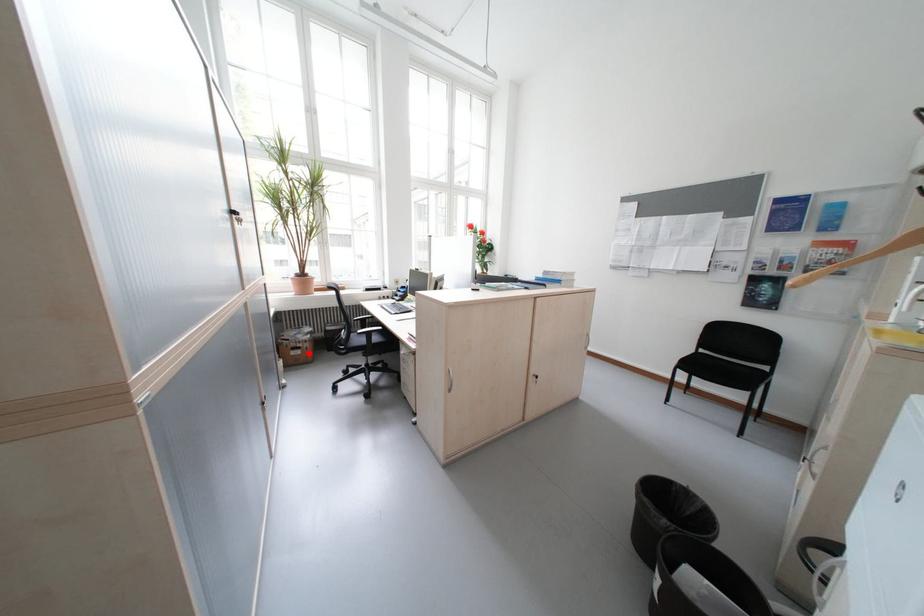
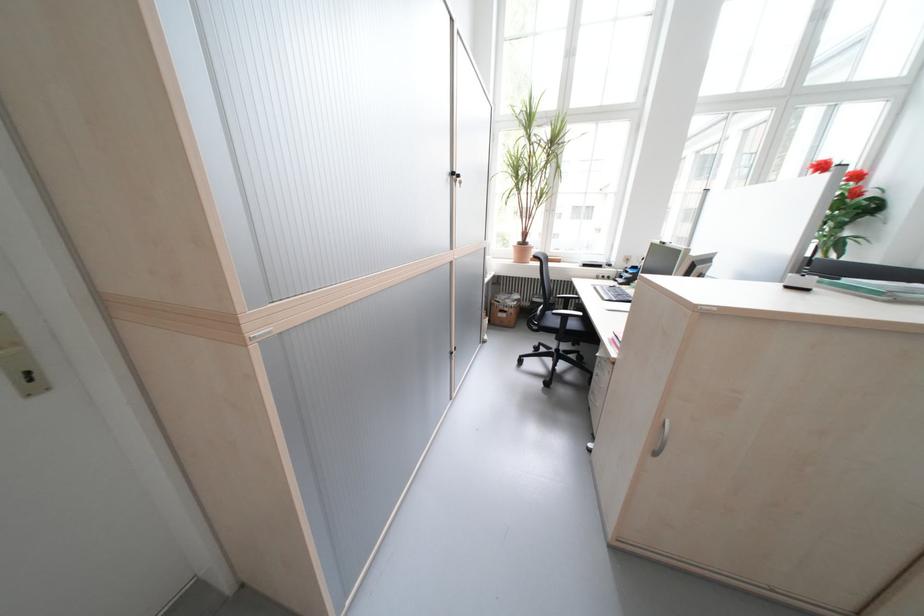
Find the pixel in the second image that matches the highlighted location in the first image.

(515, 315)